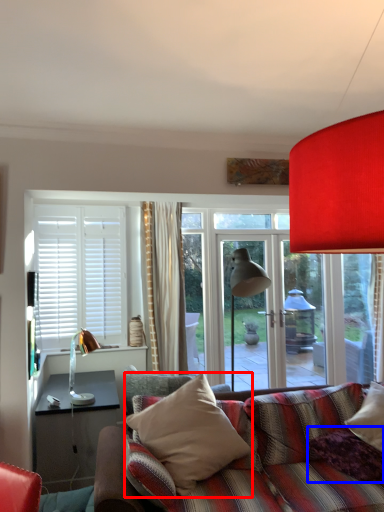
Question: Among these objects, which one is nearest to the camera, pillow (highlighted by a red box) or pillow (highlighted by a blue box)?

Choices:
 (A) pillow
 (B) pillow

Answer: (A)